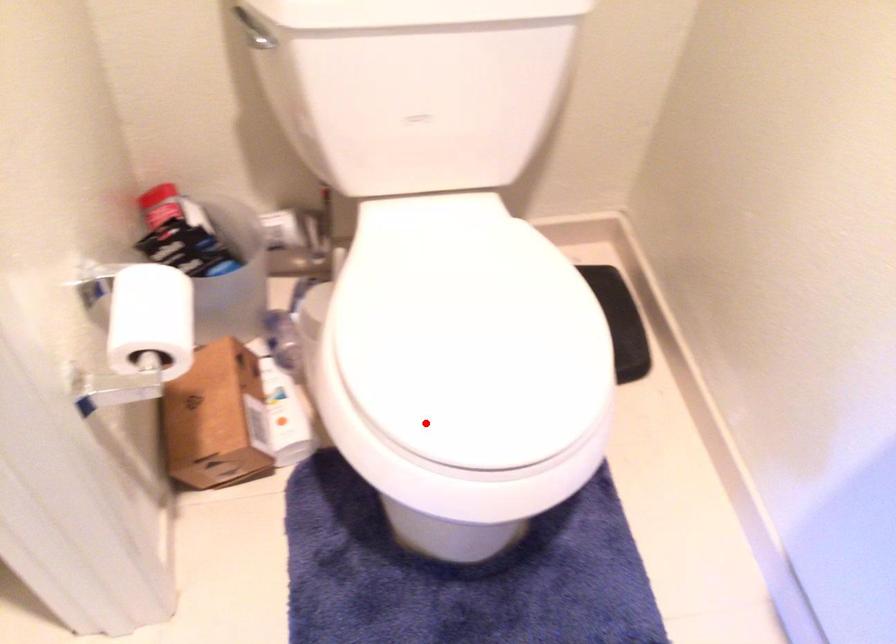
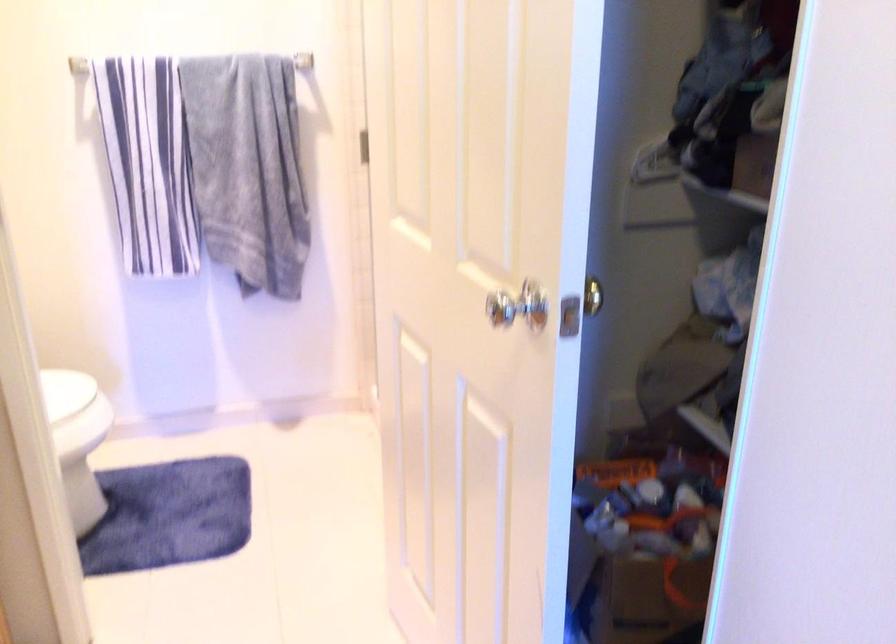
In the second image, find the point that corresponds to the highlighted location in the first image.

(72, 400)